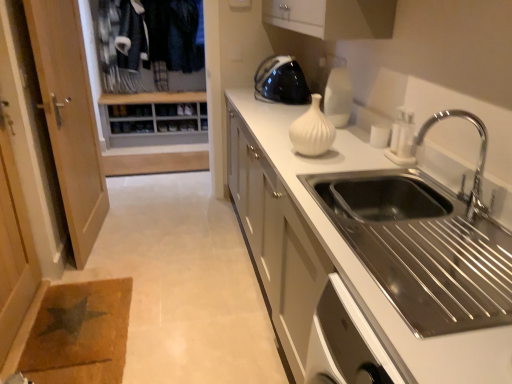
This screenshot has width=512, height=384. What are the coordinates of `vacant area located to the right-hand side of white matte vase at center` in the screenshot? It's located at point(351,153).